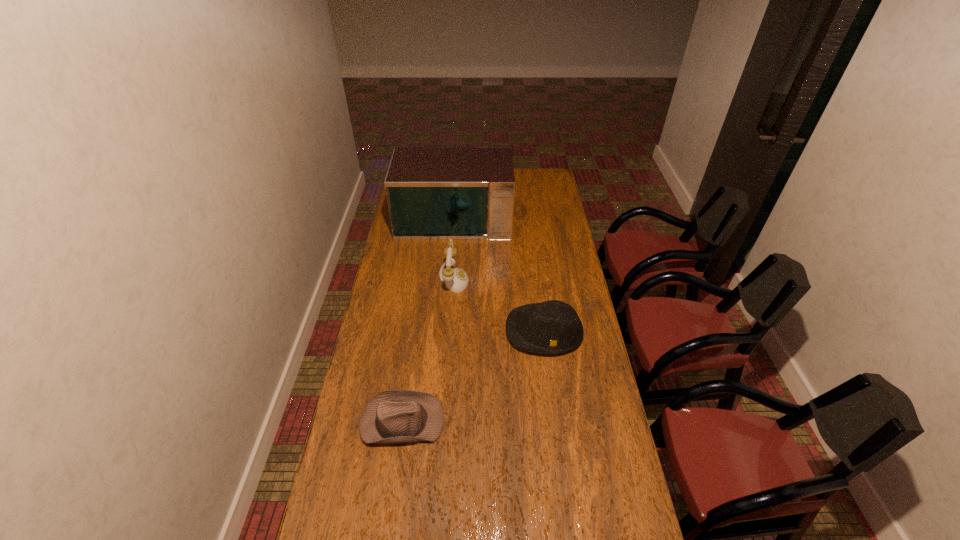
The height and width of the screenshot is (540, 960). I want to click on microwave oven, so click(x=433, y=193).

This screenshot has height=540, width=960. Identify the location of the farthest object. [433, 193].

Locate an element on the screen. This screenshot has width=960, height=540. the third shortest object is located at coordinates (456, 279).

Locate an element on the screen. telephone is located at coordinates (456, 279).

Identify the location of the taller fedora. Image resolution: width=960 pixels, height=540 pixels. (551, 327).

Locate an element on the screen. Image resolution: width=960 pixels, height=540 pixels. the right fedora is located at coordinates (551, 327).

The height and width of the screenshot is (540, 960). What are the coordinates of `the nearer fedora` in the screenshot? It's located at (394, 416).

Identify the location of the shortest object. The image size is (960, 540). (394, 416).

In order to click on free spot located on the front-facing side of the farthest object in this screenshot , I will do `click(448, 293)`.

In order to click on free location located on the dial of the third shortest object in this screenshot , I will do `click(489, 280)`.